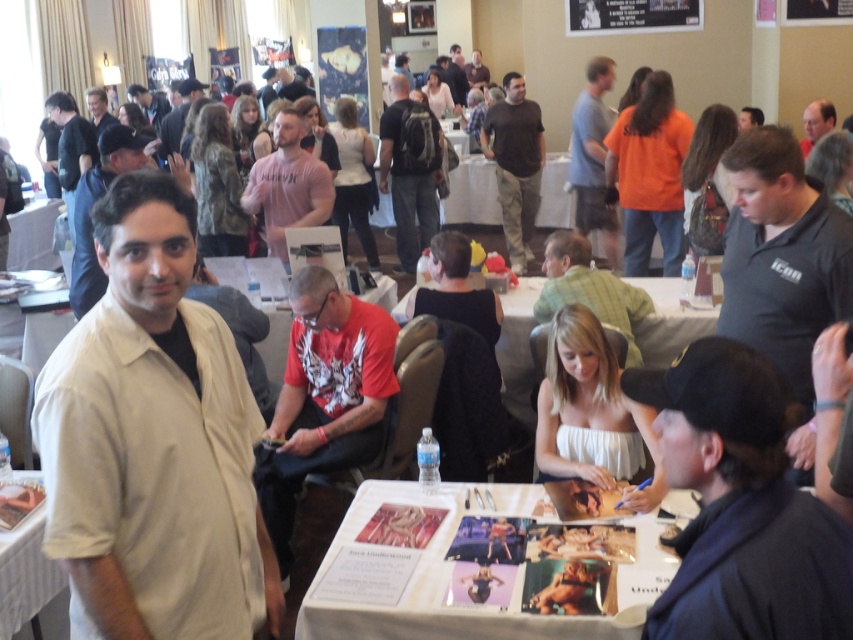
You are a photographer at this event and need to capture a photo that includes both the beige shirt at center and the black matte shirt at right. Considering their heights, which one should you adjust the camera angle to focus on to ensure both are visible in the frame?

Since the beige shirt at center is taller than the black matte shirt at right, you should lower the camera angle slightly to include the full height of the taller individual while still capturing the shorter one in the frame.

You are organizing a photo shoot in the event hall and need to position two props. The black cap at lower right and the matte black backpack at upper center are part of the setup. To ensure they are within a 50 feet distance for a wide shot, will their current placement work?

The black cap at lower right and matte black backpack at upper center are 46.97 feet apart, which is within the 50 feet requirement. Their current placement works for the wide shot.